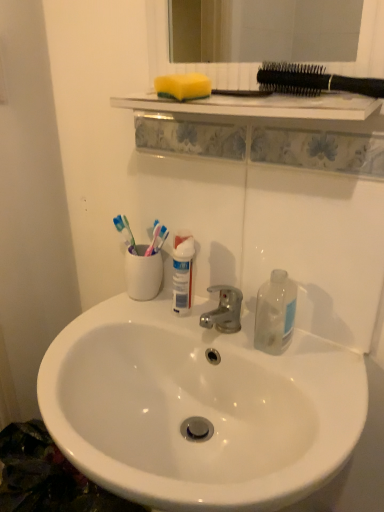
Question: Is transparent plastic bottle at right wider or thinner than white glossy sink at center?

Choices:
 (A) wide
 (B) thin

Answer: (B)

Question: From the image's perspective, is transparent plastic bottle at right located above or below white glossy sink at center?

Choices:
 (A) above
 (B) below

Answer: (A)

Question: Estimate the real-world distances between objects in this image. Which object is farther from the white ceramic toothbrush holder at center?

Choices:
 (A) transparent plastic bottle at right
 (B) black plastic toothbrushes at upper right
 (C) white glossy sink at center
 (D) yellow sponge at upper center

Answer: (B)

Question: Which object is the farthest from the yellow sponge at upper center?

Choices:
 (A) white glossy sink at center
 (B) white ceramic toothbrush holder at center
 (C) transparent plastic bottle at right
 (D) black plastic toothbrushes at upper right

Answer: (A)